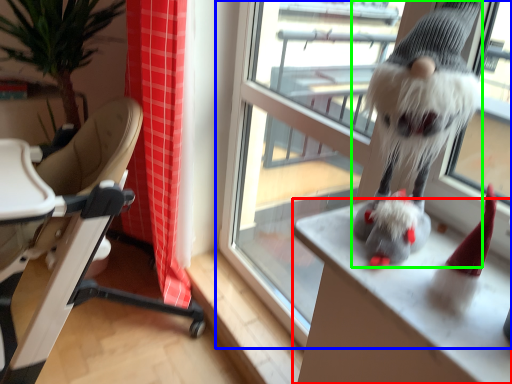
Question: Estimate the real-world distances between objects in this image. Which object is closer to desk (highlighted by a red box), window (highlighted by a blue box) or animal (highlighted by a green box)?

Choices:
 (A) window
 (B) animal

Answer: (B)